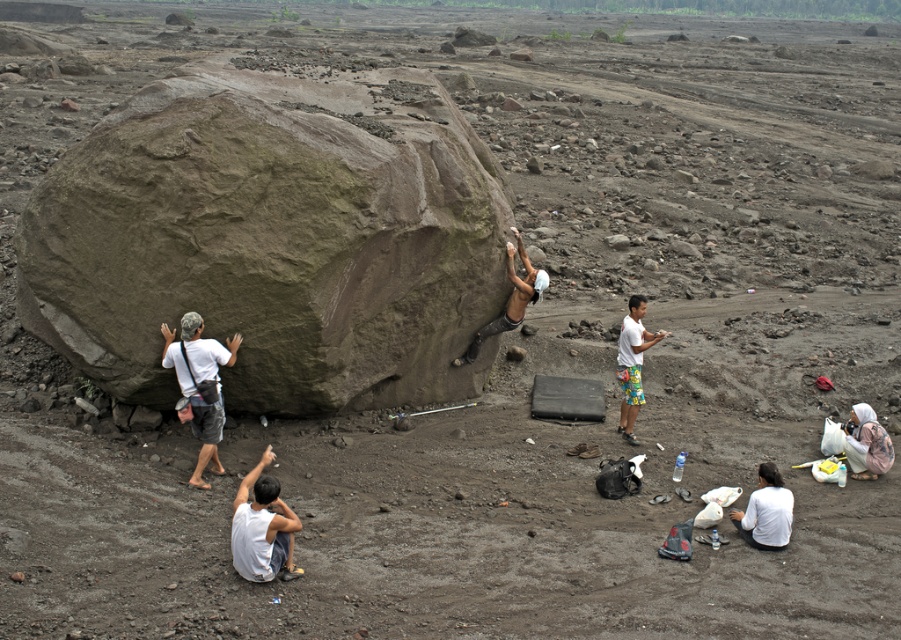
Consider the image. You are a photographer positioned at the base of the boulder and want to capture both the white cotton shirt at lower center and the matte gray shorts at left in the same frame. Based on their positions, which object should you focus on first to ensure both are in focus?

The white cotton shirt at lower center is located below matte gray shorts at left. To ensure both are in focus, you should focus on the matte gray shorts at left first since it is closer to the camera, and the white cotton shirt at lower center is further away.

You are a photographer positioned behind the boulder and want to capture both the matte gray shorts at left and the white cotton shirt at right in the same photo. Will both be visible in the frame if you adjust your camera angle appropriately?

Yes, both the matte gray shorts at left and the white cotton shirt at right will be visible in the frame because the matte gray shorts at left is in front of the white cotton shirt at right, allowing for an overlapping composition without blocking either entirely.

Based on the photo, you are standing at point (238, 141) and want to walk to point (207, 417). Which direction should you move in relative to the boulder?

You should move towards the front of the boulder since point (238, 141) is behind point (207, 417), meaning the destination is in front of your current position relative to the boulder.